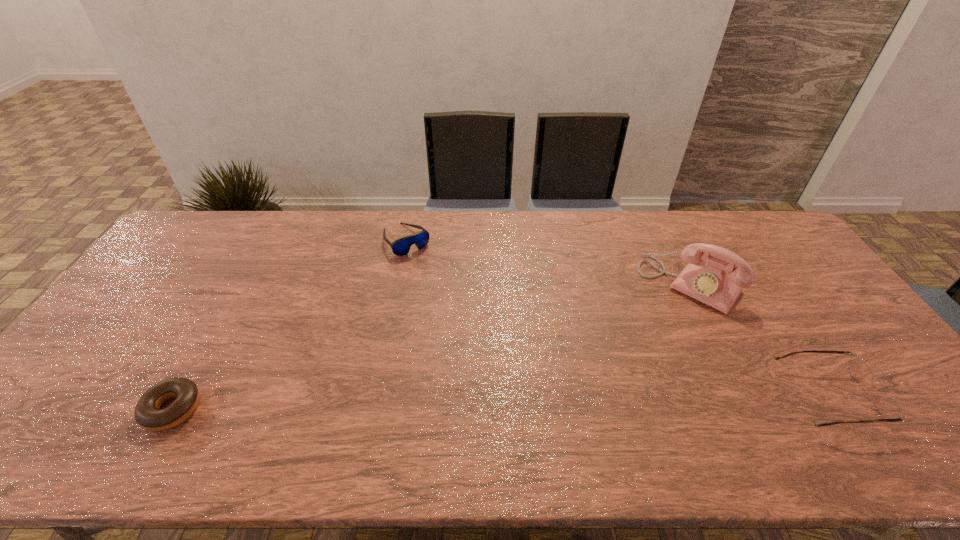
You are a GUI agent. You are given a task and a screenshot of the screen. Output one action in this format:
    pyautogui.click(x=<x>, y=<y>)
    Task: Click on the shortest object
    Image resolution: width=960 pixels, height=540 pixels.
    Given the screenshot: What is the action you would take?
    pyautogui.click(x=148, y=414)

The width and height of the screenshot is (960, 540). I want to click on the leftmost object, so click(x=148, y=414).

I want to click on spectacles, so click(888, 409).

Where is `the tallest object`? This screenshot has width=960, height=540. the tallest object is located at coordinates (709, 284).

Locate an element on the screen. Image resolution: width=960 pixels, height=540 pixels. sunglasses is located at coordinates (400, 247).

Find the location of a particular element. The width and height of the screenshot is (960, 540). vacant space located 0.230m on the back of the leftmost object is located at coordinates (225, 316).

At what (x,y) coordinates should I click in order to perform the action: click on vacant point located on the front-facing side of the spectacles. Please return your answer as a coordinate pair (x, y). The image size is (960, 540). Looking at the image, I should click on (898, 397).

Identify the location of vacant space located on the dial of the telephone. This screenshot has height=540, width=960. (653, 328).

What are the coordinates of `free space located on the dial of the telephone` in the screenshot? It's located at (609, 386).

This screenshot has width=960, height=540. In order to click on vacant position located 0.310m on the dial of the telephone in this screenshot , I will do `click(616, 375)`.